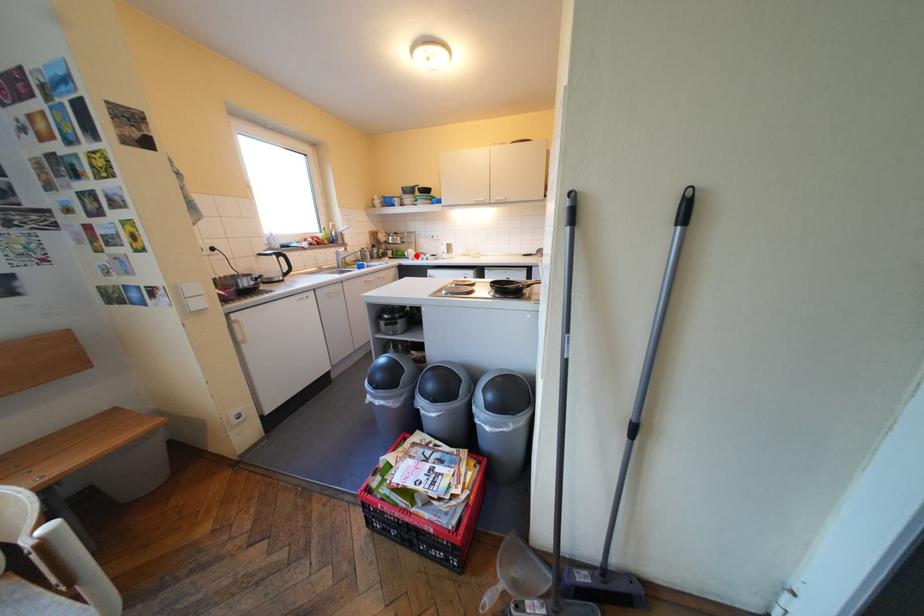
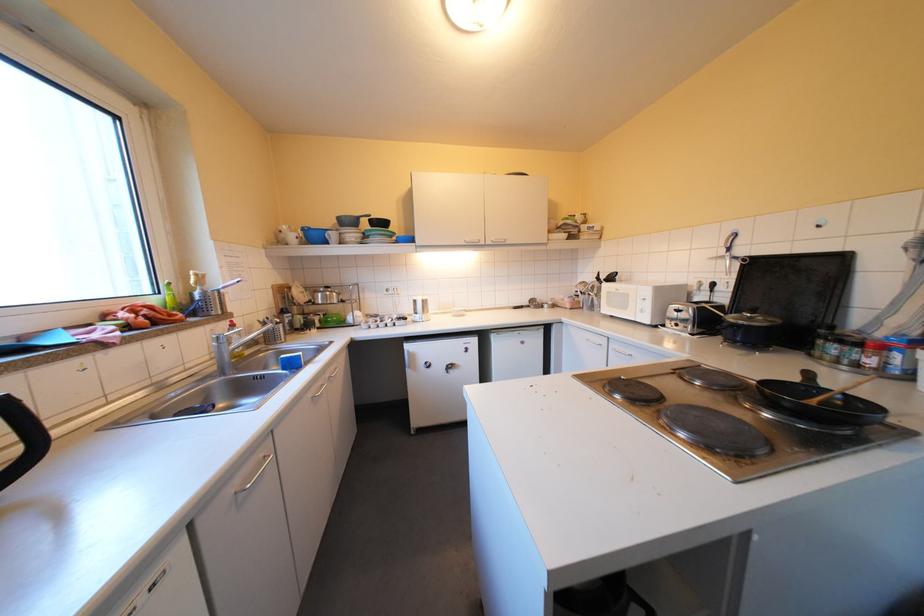
Question: I am providing you with two images of the same scene from different viewpoints. A red point is marked on the first image. At the location where the point appears in image 1, is it still visible in image 2?

Choices:
 (A) Yes
 (B) No

Answer: (A)